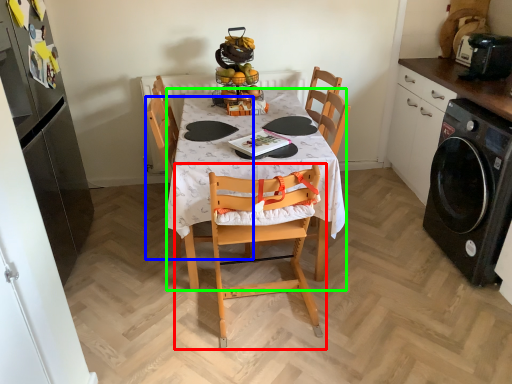
Question: Estimate the real-world distances between objects in this image. Which object is closer to chair (highlighted by a red box), chair (highlighted by a blue box) or desk (highlighted by a green box)?

Choices:
 (A) chair
 (B) desk

Answer: (B)